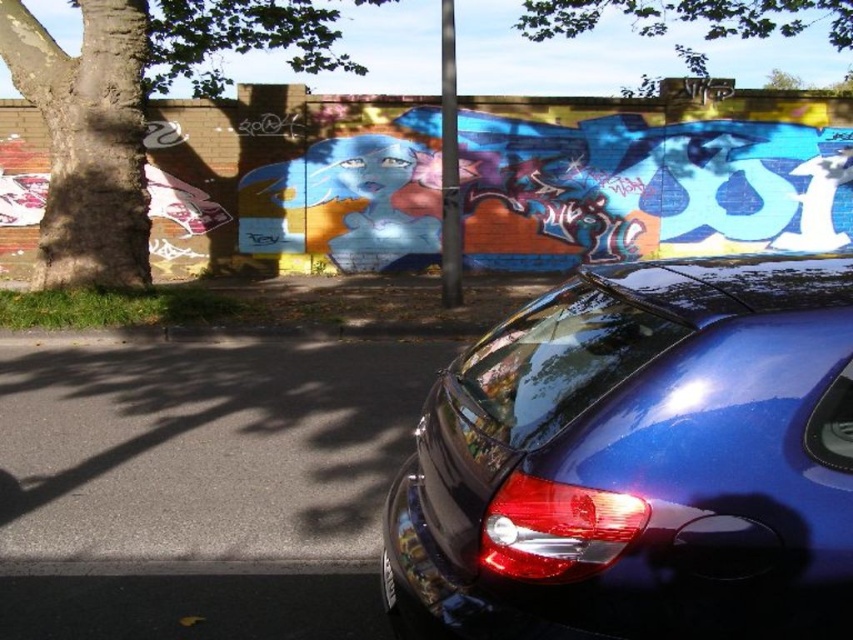
Which is more to the right, glossy blue car at lower right or green leafy tree at upper center?

Positioned to the right is green leafy tree at upper center.

Is glossy blue car at lower right to the left of green leafy tree at upper center from the viewer's perspective?

Yes, glossy blue car at lower right is to the left of green leafy tree at upper center.

The width and height of the screenshot is (853, 640). I want to click on glossy blue car at lower right, so click(639, 460).

Is glossy blue car at lower right closer to camera compared to brown rough tree trunk at left?

Result: Yes, glossy blue car at lower right is closer to the viewer.

Can you confirm if glossy blue car at lower right is thinner than brown rough tree trunk at left?

Correct, glossy blue car at lower right's width is less than brown rough tree trunk at left's.

Who is more distant from viewer, (585, 316) or (167, 8)?

Point (167, 8)

Find the location of a particular element. glossy blue car at lower right is located at coordinates tap(639, 460).

Between green leafy tree at upper center and black plastic license plate at lower center, which one is positioned higher?

green leafy tree at upper center

Based on the photo, can you confirm if green leafy tree at upper center is positioned above black plastic license plate at lower center?

Indeed, green leafy tree at upper center is positioned over black plastic license plate at lower center.

Between point (706, 4) and point (383, 596), which one is positioned behind?

The point (706, 4) is behind.

The width and height of the screenshot is (853, 640). I want to click on green leafy tree at upper center, so click(689, 17).